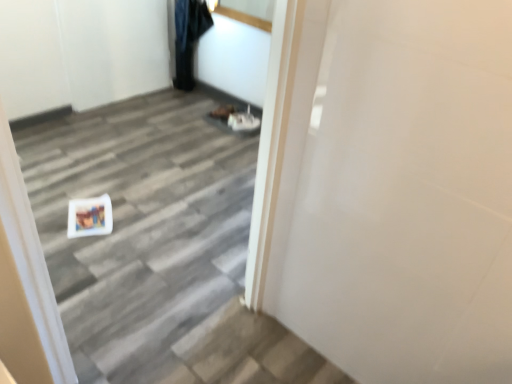
Question: Considering the relative positions of white glossy door at center and denim pants at upper center in the image provided, is white glossy door at center to the left or to the right of denim pants at upper center?

Choices:
 (A) right
 (B) left

Answer: (A)

Question: Considering the positions of white glossy door at center and denim pants at upper center in the image, is white glossy door at center taller or shorter than denim pants at upper center?

Choices:
 (A) short
 (B) tall

Answer: (B)

Question: Is point [186, 208] closer or farther from the camera than point [200, 13]?

Choices:
 (A) closer
 (B) farther

Answer: (A)

Question: From a real-world perspective, is denim pants at upper center positioned above or below white glossy door at center?

Choices:
 (A) above
 (B) below

Answer: (B)

Question: From the image's perspective, is denim pants at upper center located above or below white glossy door at center?

Choices:
 (A) above
 (B) below

Answer: (A)

Question: Which is correct: denim pants at upper center is inside white glossy door at center, or outside of it?

Choices:
 (A) outside
 (B) inside

Answer: (A)

Question: In the image, is denim pants at upper center on the left side or the right side of white glossy door at center?

Choices:
 (A) right
 (B) left

Answer: (B)